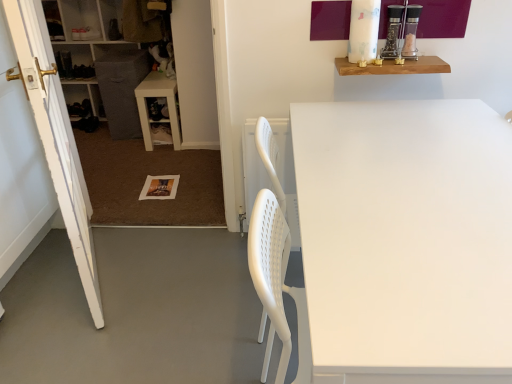
The image size is (512, 384). In order to click on free space in front of white plastic table at lower left, the 2th table positioned from the bottom in this screenshot , I will do point(162,160).